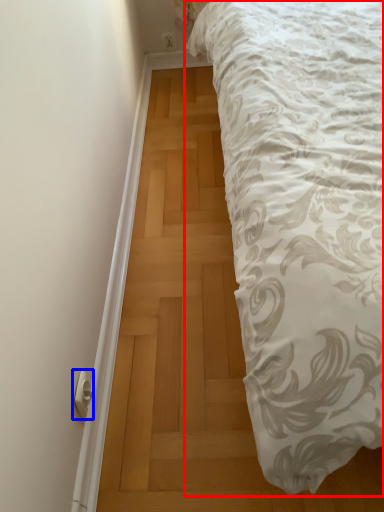
Question: Which of the following is the closest to the observer, bed (highlighted by a red box) or door handle (highlighted by a blue box)?

Choices:
 (A) bed
 (B) door handle

Answer: (A)